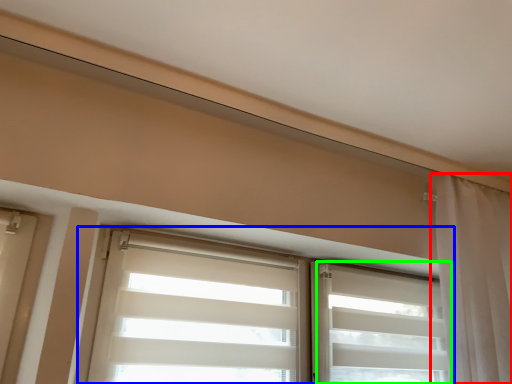
Question: Which object is positioned closest to curtain (highlighted by a red box)? Select from window (highlighted by a blue box) and shutter (highlighted by a green box).

Choices:
 (A) window
 (B) shutter

Answer: (B)